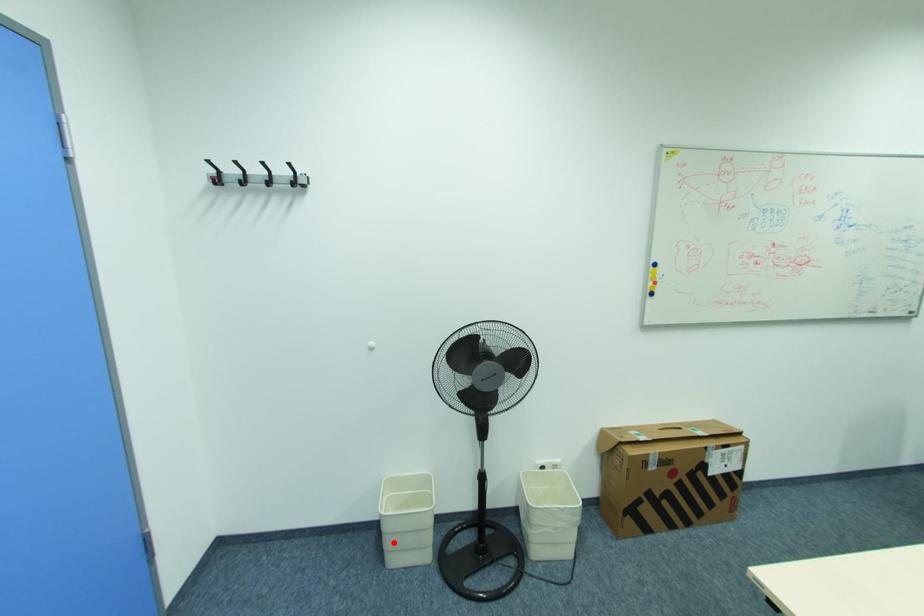
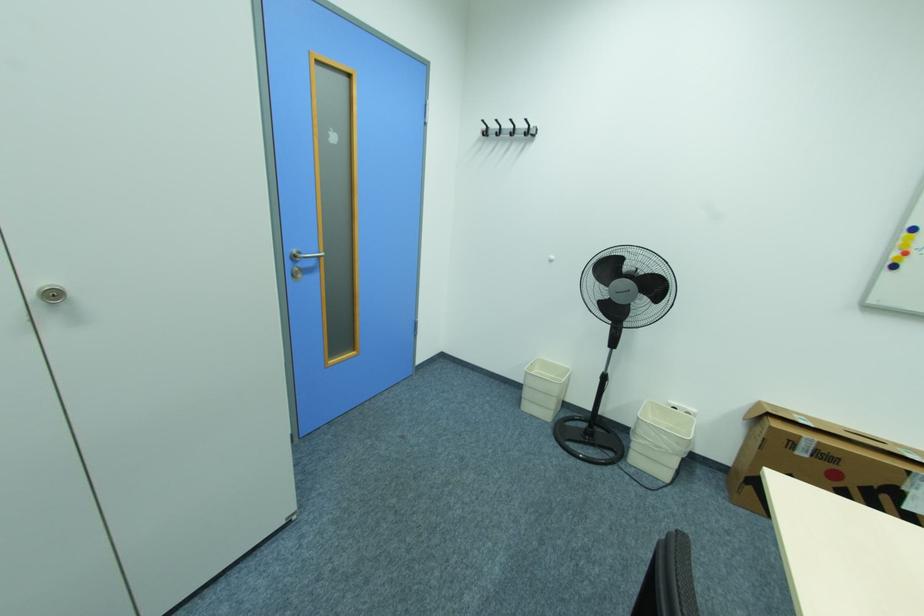
The point at the highlighted location is marked in the first image. Where is the corresponding point in the second image?

(531, 394)